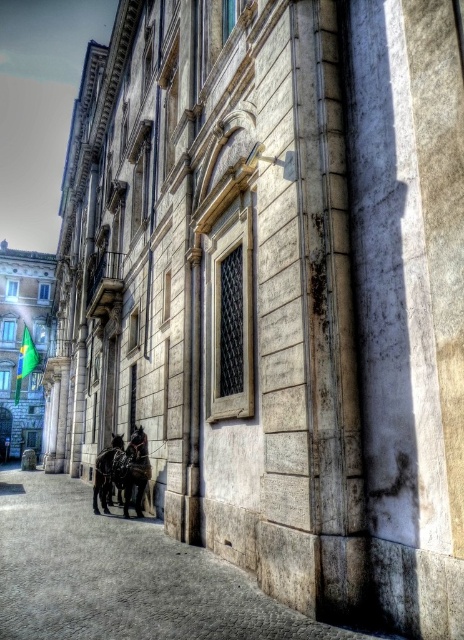
Question: Which of the following is the closest to the observer?

Choices:
 (A) stone textured alley at lower left
 (B) shiny black horse at lower left

Answer: (A)

Question: Which of the following is the farthest from the observer?

Choices:
 (A) (107, 448)
 (B) (291, 612)

Answer: (A)

Question: Is the position of stone textured alley at lower left less distant than that of shiny black horse at lower left?

Choices:
 (A) yes
 (B) no

Answer: (A)

Question: Can you confirm if stone textured alley at lower left is smaller than shiny black horse at lower left?

Choices:
 (A) no
 (B) yes

Answer: (A)

Question: Which point is farther from the camera taking this photo?

Choices:
 (A) (107, 483)
 (B) (141, 445)
 (C) (32, 484)

Answer: (C)

Question: Does stone textured alley at lower left have a greater width compared to shiny black horse at center?

Choices:
 (A) no
 (B) yes

Answer: (B)